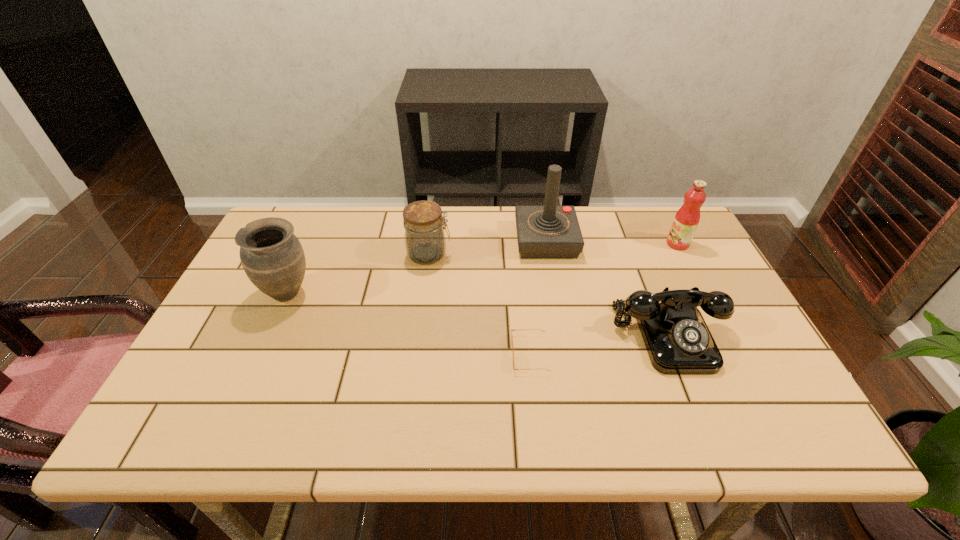
Identify the location of vacant region between the sunglasses and the second object from left to right. The width and height of the screenshot is (960, 540). (479, 304).

The image size is (960, 540). Find the location of `vacant space that is in between the leftmost object and the joystick`. vacant space that is in between the leftmost object and the joystick is located at coordinates (417, 267).

Where is `vacant space that's between the fruit juice and the joystick`? vacant space that's between the fruit juice and the joystick is located at coordinates (612, 242).

Locate an element on the screen. The width and height of the screenshot is (960, 540). vacant space in between the tallest object and the fifth object from right to left is located at coordinates (488, 248).

In order to click on free space between the shortest object and the joystick in this screenshot , I will do `click(538, 298)`.

I want to click on free space between the fruit juice and the joystick, so 612,242.

Find the location of a particular element. The height and width of the screenshot is (540, 960). free area in between the telephone and the joystick is located at coordinates (608, 289).

The height and width of the screenshot is (540, 960). I want to click on free spot between the fifth tallest object and the shortest object, so click(x=600, y=345).

I want to click on object that stands as the closest to the tallest object, so click(678, 341).

The image size is (960, 540). What are the coordinates of `object that is the fourth closest to the tallest object` in the screenshot? It's located at (511, 329).